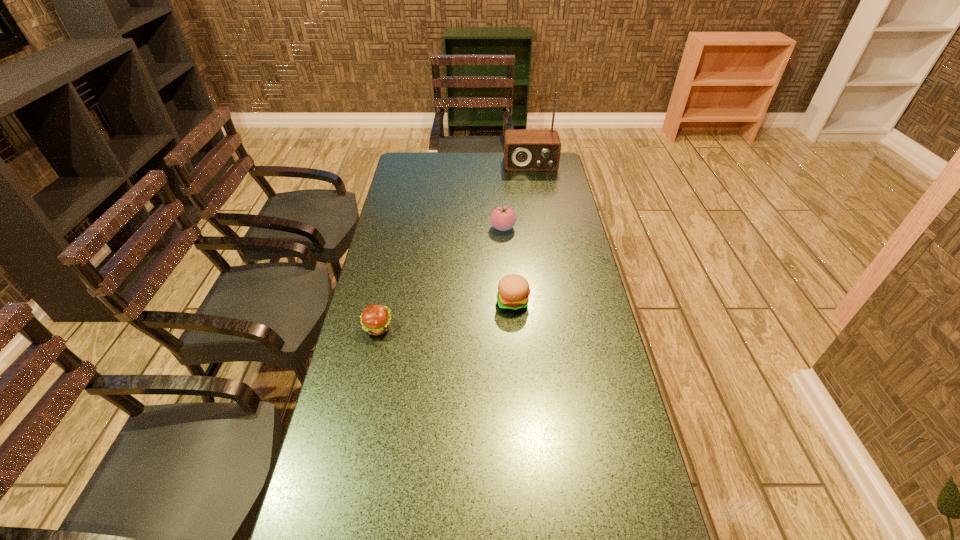
At what (x,y) coordinates should I click in order to perform the action: click on blank space located 0.130m on the back of the nearest object. Please return your answer as a coordinate pair (x, y). This screenshot has width=960, height=540. Looking at the image, I should click on (386, 287).

You are a GUI agent. You are given a task and a screenshot of the screen. Output one action in this format:
    pyautogui.click(x=<x>, y=<y>)
    Task: Click on the object situated at the far edge
    Image resolution: width=960 pixels, height=540 pixels.
    Given the screenshot: What is the action you would take?
    pyautogui.click(x=524, y=150)

Locate an element on the screen. The height and width of the screenshot is (540, 960). object present at the left edge is located at coordinates (375, 319).

I want to click on object that is at the right edge, so click(x=524, y=150).

I want to click on object present at the far right corner, so click(524, 150).

Find the location of a particular element. The width and height of the screenshot is (960, 540). vacant space at the far edge of the desktop is located at coordinates (492, 174).

Locate an element on the screen. The image size is (960, 540). free spot at the left edge of the desktop is located at coordinates (412, 213).

I want to click on vacant space at the right edge, so click(612, 500).

At what (x,y) coordinates should I click in order to perform the action: click on free space at the far left corner of the desktop. Please return your answer as a coordinate pair (x, y). Looking at the image, I should click on (419, 178).

Identify the location of vacant area that lies between the tallest object and the nearest object. The image size is (960, 540). (454, 246).